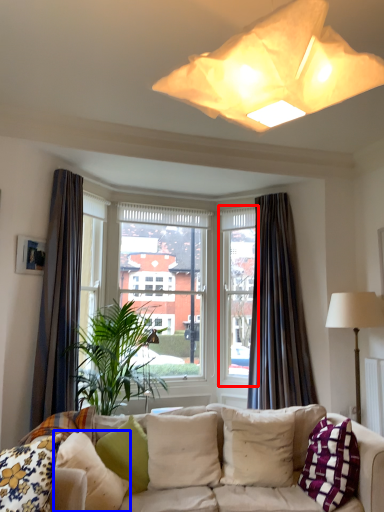
Question: Which point is further to the camera, window frame (highlighted by a red box) or pillow (highlighted by a blue box)?

Choices:
 (A) window frame
 (B) pillow

Answer: (A)